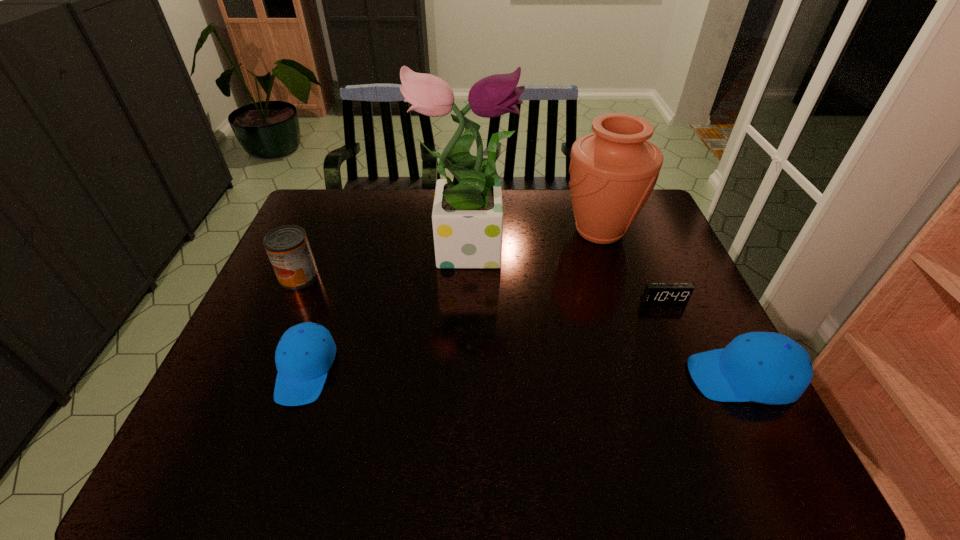
Where is `vacant point located on the front-facing side of the fourth tallest object`? The height and width of the screenshot is (540, 960). vacant point located on the front-facing side of the fourth tallest object is located at coordinates (542, 377).

At what (x,y) coordinates should I click in order to perform the action: click on vacant space situated on the front-facing side of the fourth tallest object. Please return your answer as a coordinate pair (x, y). The height and width of the screenshot is (540, 960). Looking at the image, I should click on pyautogui.click(x=598, y=377).

The image size is (960, 540). Identify the location of vacant space located on the front-facing side of the fourth tallest object. (555, 377).

Where is `free space located on the front-facing side of the tallest object`? Image resolution: width=960 pixels, height=540 pixels. free space located on the front-facing side of the tallest object is located at coordinates (581, 245).

Where is `vacant space located 0.230m on the left of the vase`? vacant space located 0.230m on the left of the vase is located at coordinates (489, 232).

The image size is (960, 540). I want to click on free space located on the front of the fourth shortest object, so click(x=252, y=386).

Locate an element on the screen. This screenshot has height=540, width=960. free space located 0.320m on the front-facing side of the fourth farthest object is located at coordinates (710, 410).

Image resolution: width=960 pixels, height=540 pixels. In order to click on flower arrangement that is at the far edge in this screenshot , I will do `click(467, 217)`.

Where is `vase positioned at the far edge`? The image size is (960, 540). vase positioned at the far edge is located at coordinates (613, 171).

Find the location of a particular element. This screenshot has height=540, width=960. cap located in the left edge section of the desktop is located at coordinates (305, 353).